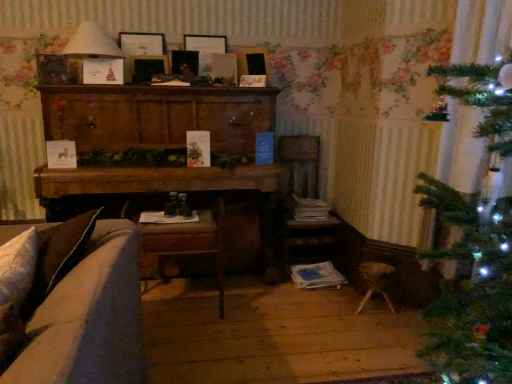
The width and height of the screenshot is (512, 384). What are the coordinates of `free spot in front of woodenchair at lower center` in the screenshot? It's located at (187, 345).